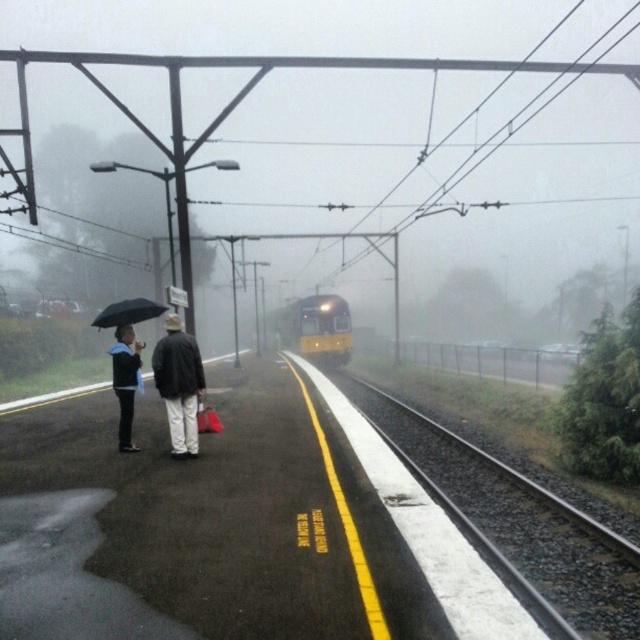
Question: Which object is positioned farthest from the smooth steel train track at center?

Choices:
 (A) yellow metallic train at center
 (B) matte black umbrella at left
 (C) dark gray fabric jacket at center

Answer: (A)

Question: Estimate the real-world distances between objects in this image. Which object is farther from the smooth steel train track at center?

Choices:
 (A) dark gray fabric jacket at center
 (B) yellow metallic train at center
 (C) matte black jacket at left
 (D) black matte umbrella at left

Answer: (B)

Question: Among these objects, which one is nearest to the camera?

Choices:
 (A) matte black umbrella at left
 (B) matte black jacket at left
 (C) yellow metallic train at center
 (D) smooth steel train track at center

Answer: (D)

Question: Does dark gray fabric jacket at center have a smaller size compared to yellow metallic train at center?

Choices:
 (A) no
 (B) yes

Answer: (B)

Question: Can you confirm if smooth steel train track at center is bigger than matte black umbrella at left?

Choices:
 (A) yes
 (B) no

Answer: (B)

Question: Can you confirm if smooth steel train track at center is positioned below yellow metallic train at center?

Choices:
 (A) no
 (B) yes

Answer: (B)